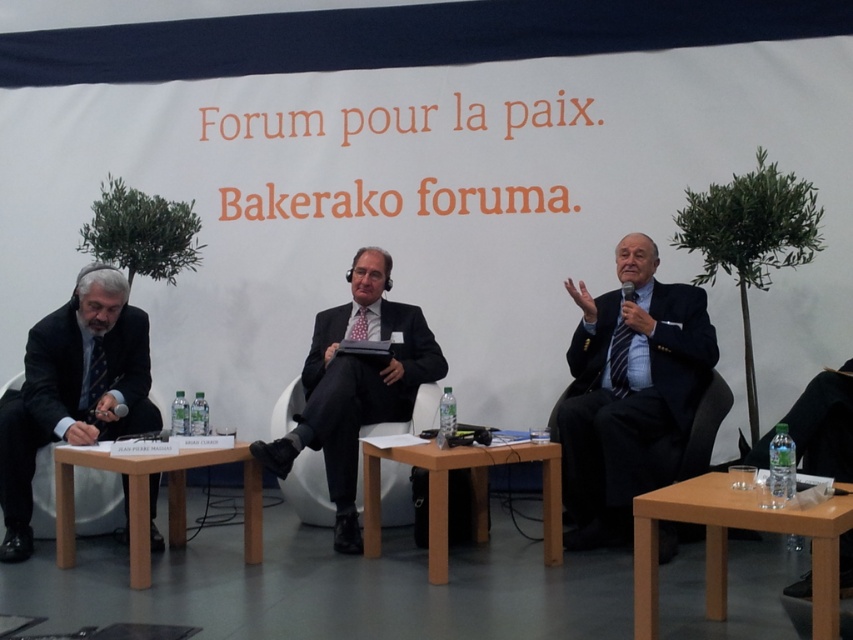
Based on the photo, you are an attendee at the Peace Forum event. You notice two points marked on the floor in the conference hall. The first point is at coordinates point (x=403, y=384) and the second at point (x=556, y=506). If you are standing at the second point, which direction should you move to reach the first point?

To reach point (x=403, y=384) from point (x=556, y=506), you should move towards the lower left direction since point (x=403, y=384) is behind point (x=556, y=506).

Based on the photo, you are an event organizer who needs to adjust seating arrangements. The dark blue textured suit at center and the light brown wood table at center are both in the front row. Which one is taller?

The dark blue textured suit at center is much taller than the light brown wood table at center, so the dark blue textured suit at center is taller.

You are an event organizer who needs to adjust seating arrangements. The black matte suit at center and the light brown wooden table at center are currently positioned in a way that might block the speaker. Based on their heights, which one should you move to ensure the speaker can be seen clearly?

The black matte suit at center is taller than the light brown wooden table at center, so you should move the black matte suit at center to ensure the speaker can be seen clearly.